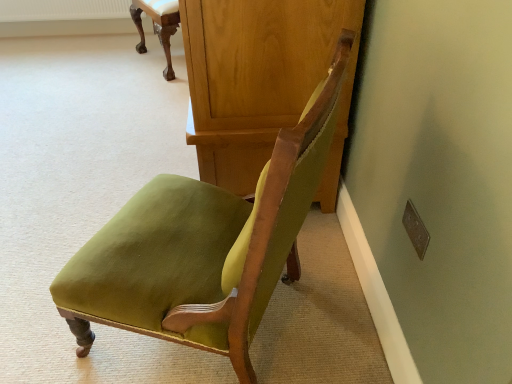
You are a GUI agent. You are given a task and a screenshot of the screen. Output one action in this format:
    pyautogui.click(x=<x>, y=<y>)
    Task: Click on the vacant space situated on the left part of matte green fabric chair at upper center, the second chair from the bottom
    
    Given the screenshot: What is the action you would take?
    pyautogui.click(x=111, y=61)